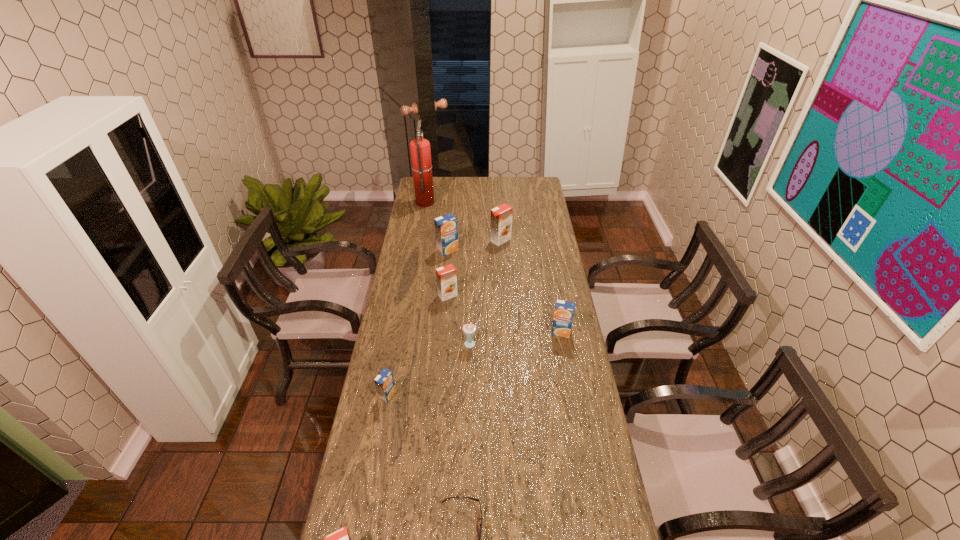
This screenshot has width=960, height=540. In order to click on blank space that satisfies the following two spatial constraints: 1. with the nozzle and gauge on the farthest object; 2. on the right side of the sixth nearest object in this screenshot , I will do `click(409, 295)`.

This screenshot has height=540, width=960. What are the coordinates of `free point that satisfies the following two spatial constraints: 1. with the nozzle and gauge on the fire extinguisher; 2. on the right side of the second object from right to left` in the screenshot? It's located at (419, 240).